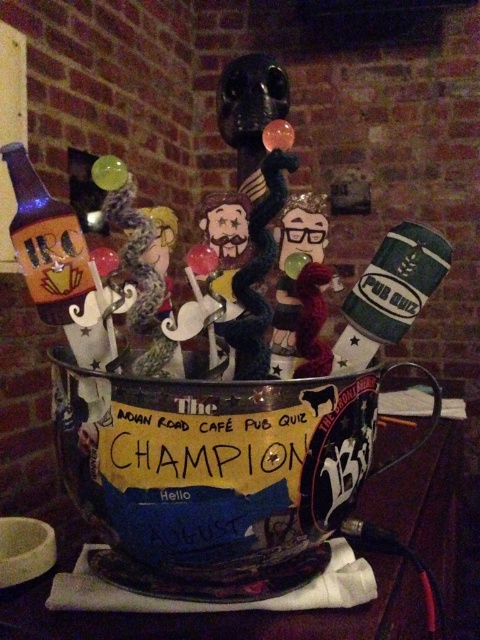
Who is positioned more to the left, green matte cup at upper right or matte glass bottle at left?

Positioned to the left is matte glass bottle at left.

Which of these two, green matte cup at upper right or matte glass bottle at left, stands taller?

matte glass bottle at left

What do you see at coordinates (391, 292) in the screenshot?
I see `green matte cup at upper right` at bounding box center [391, 292].

Where is `green matte cup at upper right`? The width and height of the screenshot is (480, 640). green matte cup at upper right is located at coordinates (391, 292).

This screenshot has width=480, height=640. Find the location of `metallic trophy at center`. metallic trophy at center is located at coordinates click(218, 612).

Can you confirm if metallic trophy at center is wider than green matte cup at upper right?

Yes.

Locate an element on the screen. Image resolution: width=480 pixels, height=640 pixels. metallic trophy at center is located at coordinates (218, 612).

Find the location of `metallic trophy at center`. metallic trophy at center is located at coordinates (218, 612).